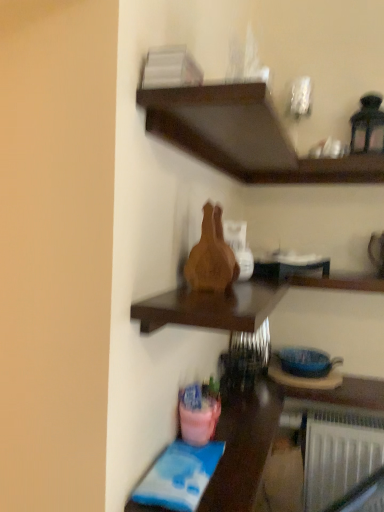
Question: Can you confirm if dark wood shelf at upper center, marked as the first shelf in a top-to-bottom arrangement, is positioned to the left of wooden vase at center, arranged as the 2th shelf when viewed from the top?

Choices:
 (A) yes
 (B) no

Answer: (B)

Question: Considering the relative sizes of dark wood shelf at upper center, positioned as the second shelf in bottom-to-top order, and wooden vase at center, arranged as the 2th shelf when viewed from the top, in the image provided, is dark wood shelf at upper center, positioned as the second shelf in bottom-to-top order, wider than wooden vase at center, arranged as the 2th shelf when viewed from the top,?

Choices:
 (A) no
 (B) yes

Answer: (B)

Question: From a real-world perspective, is dark wood shelf at upper center, positioned as the second shelf in bottom-to-top order, positioned over wooden vase at center, which is the 1th shelf from bottom to top, based on gravity?

Choices:
 (A) yes
 (B) no

Answer: (A)

Question: Considering the relative sizes of dark wood shelf at upper center, marked as the first shelf in a top-to-bottom arrangement, and wooden vase at center, which is the 1th shelf from bottom to top, in the image provided, is dark wood shelf at upper center, marked as the first shelf in a top-to-bottom arrangement, taller than wooden vase at center, which is the 1th shelf from bottom to top,?

Choices:
 (A) no
 (B) yes

Answer: (A)

Question: From the image's perspective, is dark wood shelf at upper center, marked as the first shelf in a top-to-bottom arrangement, above wooden vase at center, arranged as the 2th shelf when viewed from the top?

Choices:
 (A) no
 (B) yes

Answer: (B)

Question: Is pink plastic bucket at lower left in front of or behind wooden vase at center, which is the 1th shelf from bottom to top, in the image?

Choices:
 (A) front
 (B) behind

Answer: (B)

Question: Is pink plastic bucket at lower left spatially inside wooden vase at center, arranged as the 2th shelf when viewed from the top, or outside of it?

Choices:
 (A) inside
 (B) outside

Answer: (B)

Question: Considering the positions of pink plastic bucket at lower left and wooden vase at center, arranged as the 2th shelf when viewed from the top, in the image, is pink plastic bucket at lower left taller or shorter than wooden vase at center, arranged as the 2th shelf when viewed from the top,?

Choices:
 (A) tall
 (B) short

Answer: (A)

Question: From a real-world perspective, is pink plastic bucket at lower left positioned above or below wooden vase at center, which is the 1th shelf from bottom to top?

Choices:
 (A) above
 (B) below

Answer: (B)

Question: From their relative heights in the image, would you say wooden vase at center, arranged as the 2th shelf when viewed from the top, is taller or shorter than pink plastic bucket at lower left?

Choices:
 (A) tall
 (B) short

Answer: (B)

Question: Does point (140, 323) appear closer or farther from the camera than point (253, 461)?

Choices:
 (A) closer
 (B) farther

Answer: (A)

Question: Considering the relative positions of wooden vase at center, arranged as the 2th shelf when viewed from the top, and pink plastic bucket at lower left in the image provided, is wooden vase at center, arranged as the 2th shelf when viewed from the top, to the left or to the right of pink plastic bucket at lower left?

Choices:
 (A) right
 (B) left

Answer: (A)

Question: Is wooden vase at center, which is the 1th shelf from bottom to top, inside the boundaries of pink plastic bucket at lower left, or outside?

Choices:
 (A) inside
 (B) outside

Answer: (B)

Question: Considering their positions, is dark wood shelf at upper center, positioned as the second shelf in bottom-to-top order, located in front of or behind wooden vase at center, which is the 1th shelf from bottom to top?

Choices:
 (A) front
 (B) behind

Answer: (A)

Question: Considering the positions of dark wood shelf at upper center, positioned as the second shelf in bottom-to-top order, and wooden vase at center, which is the 1th shelf from bottom to top, in the image, is dark wood shelf at upper center, positioned as the second shelf in bottom-to-top order, taller or shorter than wooden vase at center, which is the 1th shelf from bottom to top,?

Choices:
 (A) short
 (B) tall

Answer: (A)